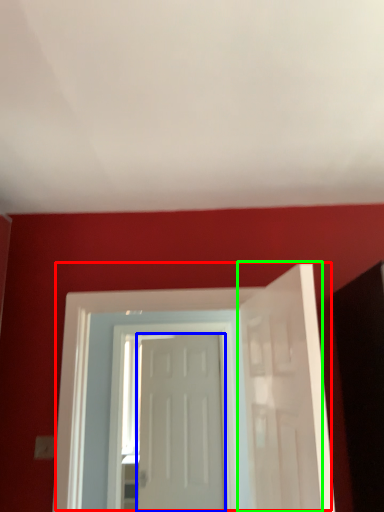
Question: Based on their relative distances, which object is farther from door (highlighted by a red box)? Choose from door (highlighted by a blue box) and door (highlighted by a green box).

Choices:
 (A) door
 (B) door

Answer: (B)